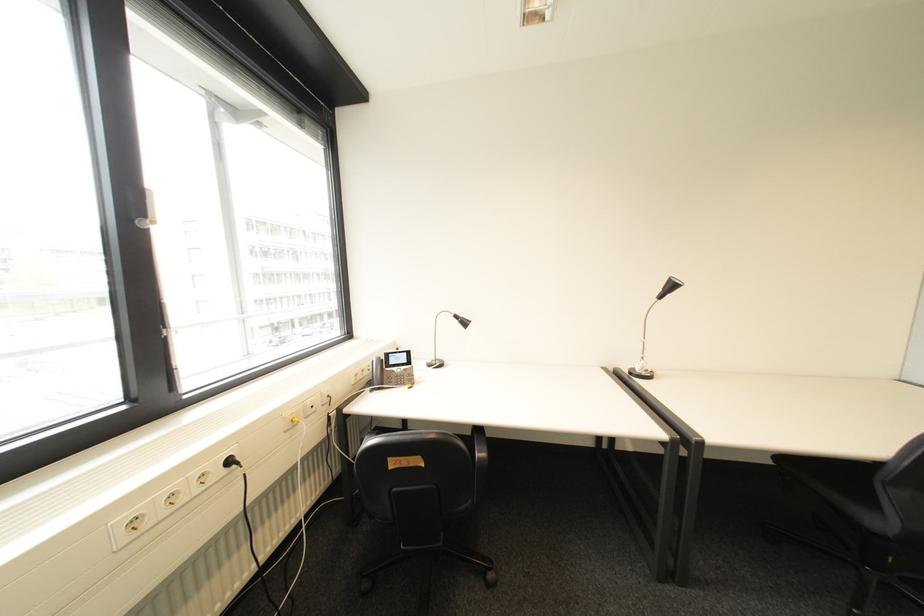
I want to click on black lamp head, so click(x=671, y=286).